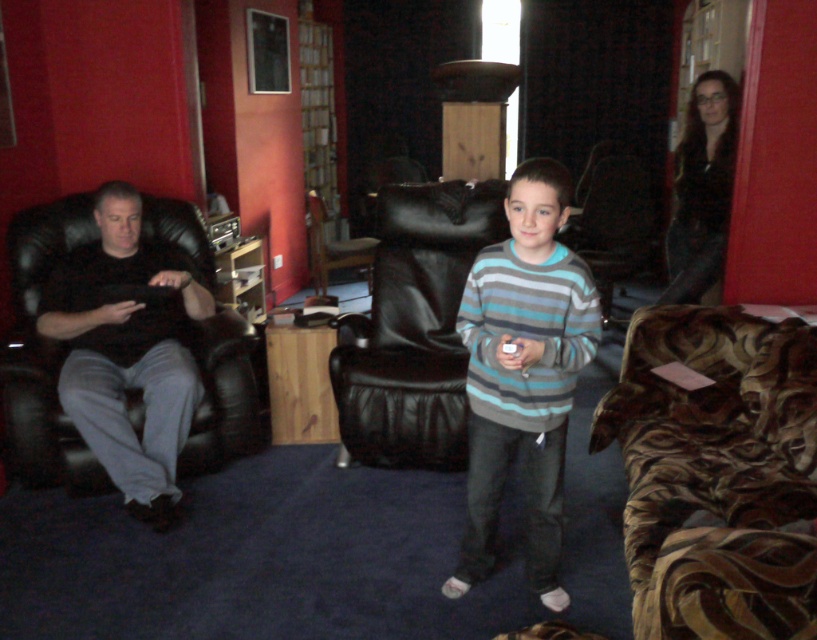
Does brown velvety couch at lower right have a lesser width compared to striped sweater at center?

In fact, brown velvety couch at lower right might be wider than striped sweater at center.

Is brown velvety couch at lower right to the right of striped sweater at center from the viewer's perspective?

Indeed, brown velvety couch at lower right is positioned on the right side of striped sweater at center.

Describe the element at coordinates (717, 474) in the screenshot. Image resolution: width=817 pixels, height=640 pixels. I see `brown velvety couch at lower right` at that location.

This screenshot has height=640, width=817. I want to click on brown velvety couch at lower right, so click(x=717, y=474).

Is point (520, 225) positioned in front of point (409, 403)?

That is True.

Can you confirm if striped sweater at center is positioned to the right of black leather armchair at center?

Correct, you'll find striped sweater at center to the right of black leather armchair at center.

Between point (498, 308) and point (496, 221), which one is positioned in front?

Point (498, 308) is in front.

Where is `striped sweater at center`? Image resolution: width=817 pixels, height=640 pixels. striped sweater at center is located at coordinates (523, 372).

Who is positioned more to the left, brown velvety couch at lower right or black leather chair at center?

black leather chair at center

Who is shorter, brown velvety couch at lower right or black leather chair at center?

black leather chair at center is shorter.

Identify the location of brown velvety couch at lower right. (717, 474).